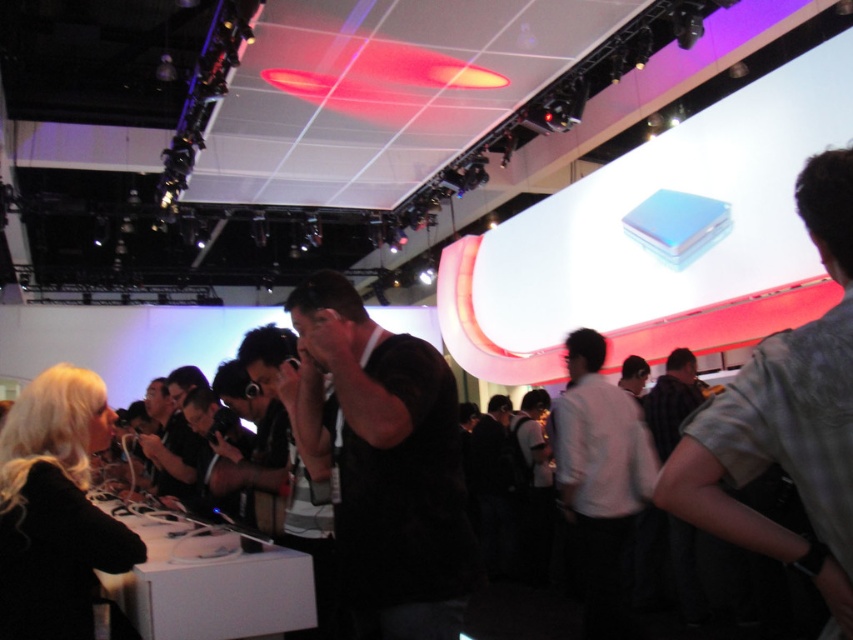
You are a photographer at the event and need to capture a clear photo of the gray fabric shirt at right without the camera in the shot. The camera is 90.18 centimeters away from the shirt. Can you move the camera closer so it doesn

The gray fabric shirt at right and camera are 90.18 centimeters apart. To avoid the camera being in the shot, you can move the camera closer to the shirt, but ensure the distance remains at least 90.18 centimeters. However, moving it closer would reduce the distance, potentially placing the camera within the frame. To keep the camera out of the shot, maintain the current distance or position it strategically without moving it closer.

You are a photographer at the event and need to capture a clear shot of the dark brown leather jacket at center without the black matte shirt at center blocking it. How should you adjust your camera angle?

The black matte shirt at center is positioned over dark brown leather jacket at center, so you should lower your camera angle to capture the dark brown leather jacket at center from below the obstruction.